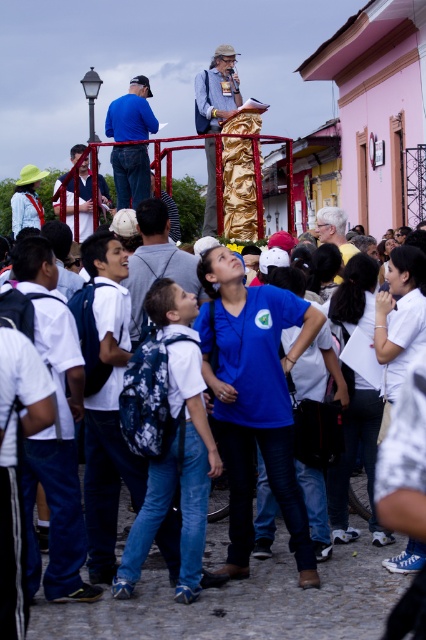
You are standing at the base of the pink building and want to hand a note to the person in the golden outfit on the elevated platform. There is a blue denim jeans at left nearby. Can you use it to reach the person?

The blue denim jeans at left are 91.99 feet away from you, which is too far to effectively use them to reach the person in the golden outfit on the elevated platform.

You are standing in the crowd and want to take a photo of both the point at coordinates point (149,93) and the point at coordinates point (80,150). Which point should you focus on first to ensure both are in focus?

You should focus on point (149,93) first because it is closer to the camera than point (80,150). This way, the depth of field will likely include both points in focus.